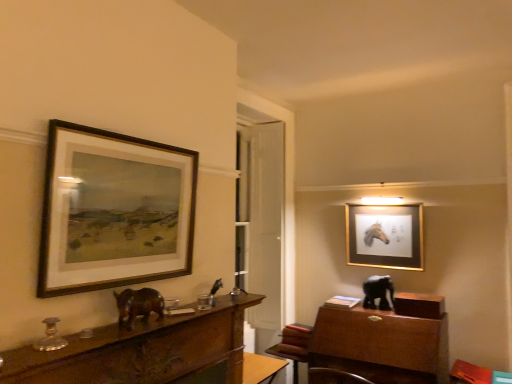
At what (x,y) coordinates should I click in order to perform the action: click on vacant space underneath shiny brown elephant at center, which is the second animal from right to left (from a real-world perspective). Please return your answer as a coordinate pair (x, y). Looking at the image, I should click on (142, 326).